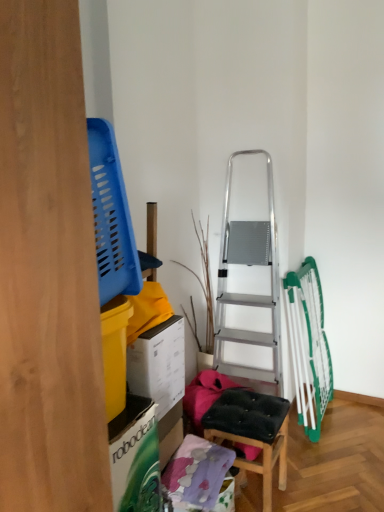
What do you see at coordinates (252, 431) in the screenshot? I see `black padded stool at center` at bounding box center [252, 431].

Where is `black padded stool at center`? black padded stool at center is located at coordinates (252, 431).

At what (x,y) coordinates should I click in order to perform the action: click on white cardboard box at left. Please return your answer as a coordinate pair (x, y). Looking at the image, I should click on (159, 364).

The height and width of the screenshot is (512, 384). What do you see at coordinates (159, 364) in the screenshot?
I see `white cardboard box at left` at bounding box center [159, 364].

Where is `black padded stool at center`? black padded stool at center is located at coordinates (252, 431).

Can you confirm if white cardboard box at left is positioned to the right of black padded stool at center?

In fact, white cardboard box at left is to the left of black padded stool at center.

Considering the positions of objects white cardboard box at left and black padded stool at center in the image provided, who is behind, white cardboard box at left or black padded stool at center?

black padded stool at center is more distant.

Considering the points (146, 391) and (247, 428), which point is in front, point (146, 391) or point (247, 428)?

The point (146, 391) is closer to the camera.

Consider the image. From the image's perspective, which one is positioned higher, white cardboard box at left or black padded stool at center?

white cardboard box at left.

From a real-world perspective, between white cardboard box at left and black padded stool at center, who is vertically higher?

In real-world perspective, white cardboard box at left is above.

Which of these two, white cardboard box at left or black padded stool at center, is thinner?

white cardboard box at left.

Considering the sizes of white cardboard box at left and black padded stool at center in the image, is white cardboard box at left taller or shorter than black padded stool at center?

Clearly, white cardboard box at left is shorter compared to black padded stool at center.

Which of these two, white cardboard box at left or black padded stool at center, is bigger?

With larger size is black padded stool at center.

Is white cardboard box at left located outside black padded stool at center?

Yes, white cardboard box at left is not within black padded stool at center.

Is white cardboard box at left positioned far away from black padded stool at center?

white cardboard box at left is near black padded stool at center, not far away.

Could you tell me if white cardboard box at left is turned towards black padded stool at center?

No, white cardboard box at left does not turn towards black padded stool at center.

Find the location of a particular element. This screenshot has width=384, height=512. furniture behind the white cardboard box at left is located at coordinates (252, 431).

Between black padded stool at center and white cardboard box at left, which one appears on the left side from the viewer's perspective?

From the viewer's perspective, white cardboard box at left appears more on the left side.

Does black padded stool at center come behind white cardboard box at left?

Yes, black padded stool at center is further from the viewer.

Which point is more distant from viewer, (220, 425) or (154, 371)?

The point (220, 425) is farther from the camera.

From the image's perspective, between black padded stool at center and white cardboard box at left, who is located below?

black padded stool at center, from the image's perspective.

From a real-world perspective, relative to white cardboard box at left, is black padded stool at center vertically above or below?

In terms of real-world spatial position, black padded stool at center is below white cardboard box at left.

From the picture: Is black padded stool at center wider than white cardboard box at left?

Yes, black padded stool at center is wider than white cardboard box at left.

Considering the sizes of objects black padded stool at center and white cardboard box at left in the image provided, who is taller, black padded stool at center or white cardboard box at left?

With more height is black padded stool at center.

Is black padded stool at center smaller than white cardboard box at left?

No, black padded stool at center is not smaller than white cardboard box at left.

Which is correct: black padded stool at center is inside white cardboard box at left, or outside of it?

black padded stool at center is spatially situated outside white cardboard box at left.

Does black padded stool at center touch white cardboard box at left?

No, black padded stool at center is not in contact with white cardboard box at left.

Is white cardboard box at left at the back of black padded stool at center?

black padded stool at center is not turned away from white cardboard box at left.

The height and width of the screenshot is (512, 384). I want to click on box in front of the black padded stool at center, so click(159, 364).

The image size is (384, 512). In order to click on furniture below the white cardboard box at left (from the image's perspective) in this screenshot , I will do `click(252, 431)`.

Where is `box located above the black padded stool at center (from the image's perspective)`? Image resolution: width=384 pixels, height=512 pixels. box located above the black padded stool at center (from the image's perspective) is located at coordinates (159, 364).